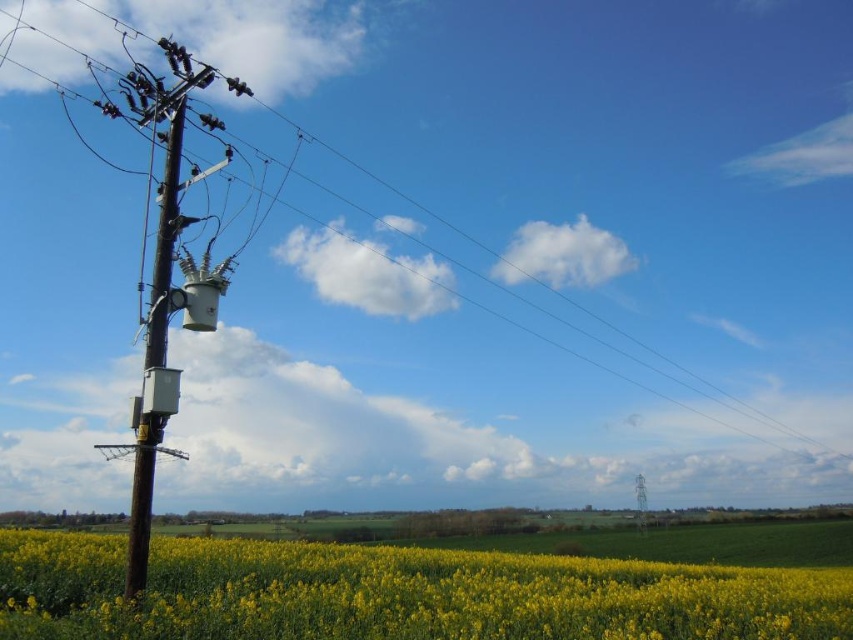
Between point (532, 77) and point (136, 556), which one is positioned behind?

The point (532, 77) is more distant.

Who is higher up, brown metallic pole at left or brown wooden pole at left?

Positioned higher is brown metallic pole at left.

Is point (135, 376) positioned before point (131, 524)?

No, (135, 376) is further to viewer.

The image size is (853, 640). I want to click on brown metallic pole at left, so click(444, 240).

Can you confirm if yellow matte flower at lower left is positioned below brown wooden telegraph pole at left?

Correct, yellow matte flower at lower left is located below brown wooden telegraph pole at left.

Is yellow matte flower at lower left positioned behind brown wooden telegraph pole at left?

No.

Between point (461, 596) and point (144, 538), which one is positioned behind?

The point (461, 596) is behind.

Find the location of a particular element. yellow matte flower at lower left is located at coordinates (398, 593).

Does yellow matte flower at lower left have a greater height compared to brown wooden pole at left?

Yes.

Between point (393, 605) and point (154, 113), which one is positioned in front?

Point (393, 605)

What do you see at coordinates (398, 593) in the screenshot? I see `yellow matte flower at lower left` at bounding box center [398, 593].

Locate an element on the screen. yellow matte flower at lower left is located at coordinates (398, 593).